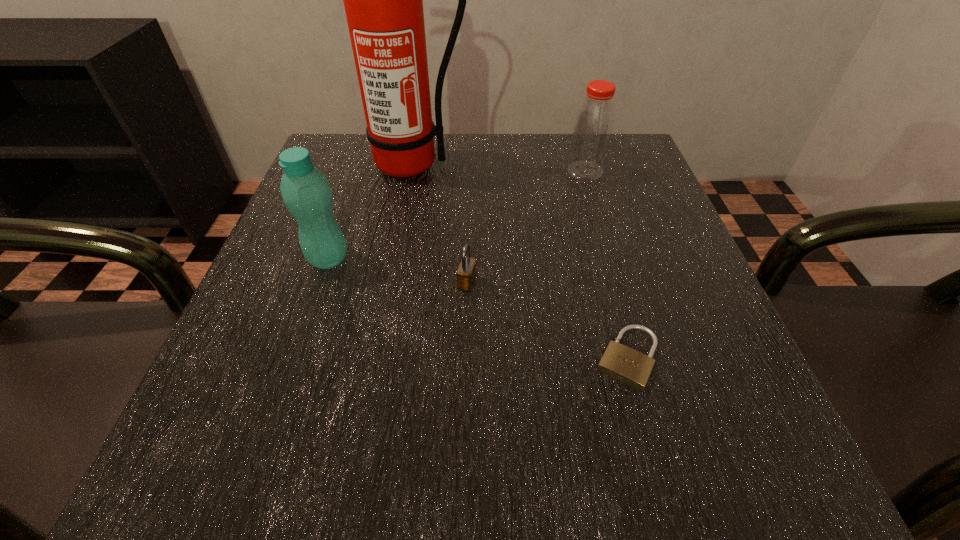
The width and height of the screenshot is (960, 540). I want to click on vacant area in the image that satisfies the following two spatial constraints: 1. on the handle side of the left padlock; 2. on the left side of the tallest object, so click(x=389, y=283).

This screenshot has height=540, width=960. What are the coordinates of `free point that satisfies the following two spatial constraints: 1. on the front side of the nearer bottle; 2. on the left side of the nearer padlock` in the screenshot? It's located at (294, 357).

This screenshot has width=960, height=540. Find the location of `free location that satisfies the following two spatial constraints: 1. on the handle side of the tallest object; 2. on the right side of the shorter padlock`. free location that satisfies the following two spatial constraints: 1. on the handle side of the tallest object; 2. on the right side of the shorter padlock is located at coordinates (374, 357).

The height and width of the screenshot is (540, 960). I want to click on vacant position in the image that satisfies the following two spatial constraints: 1. on the handle side of the fire extinguisher; 2. on the left side of the taller padlock, so click(389, 283).

Where is `vacant region that satisfies the following two spatial constraints: 1. on the handle side of the fourth tallest object; 2. on the left side of the tallest object`? The width and height of the screenshot is (960, 540). vacant region that satisfies the following two spatial constraints: 1. on the handle side of the fourth tallest object; 2. on the left side of the tallest object is located at coordinates (389, 283).